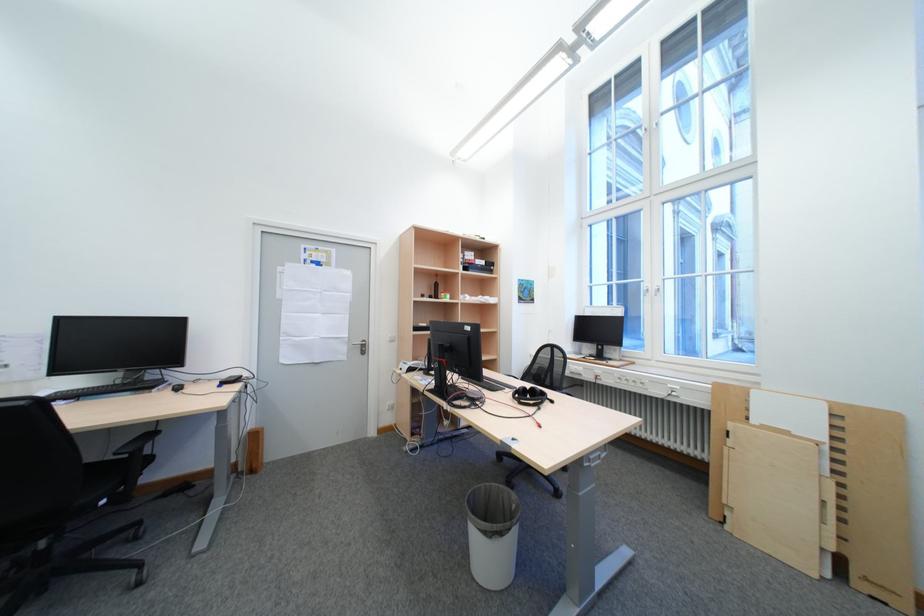
Find where to resting arm the chair armrest. Please return your answer as a coordinate pair (x, y).

(146, 445)